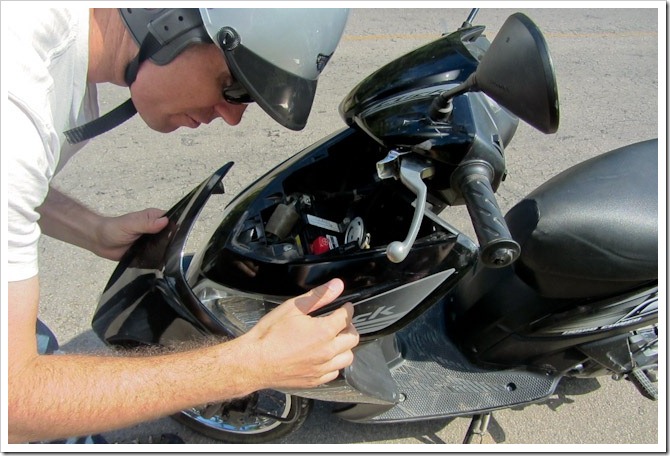
Identify the location of mirror. This screenshot has width=670, height=456. (545, 85).